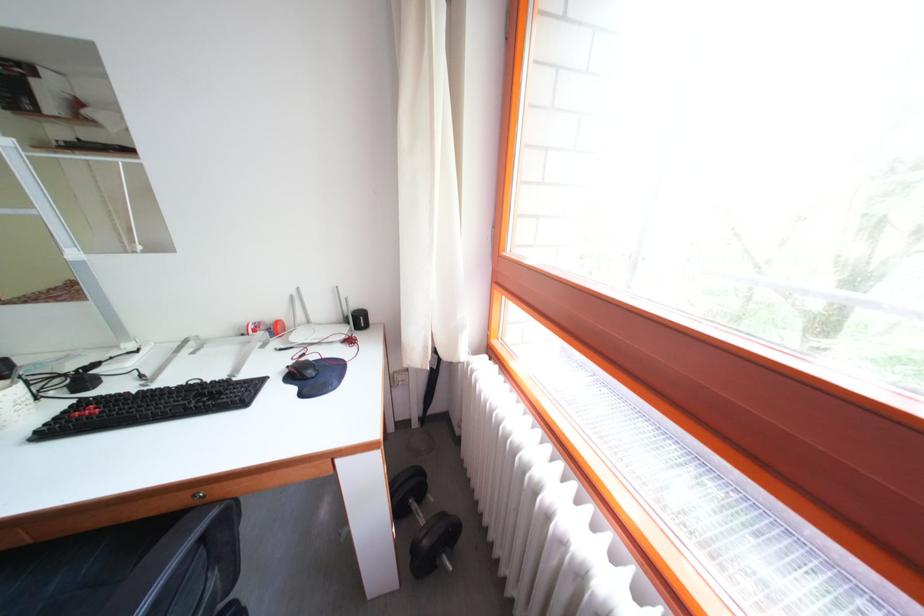
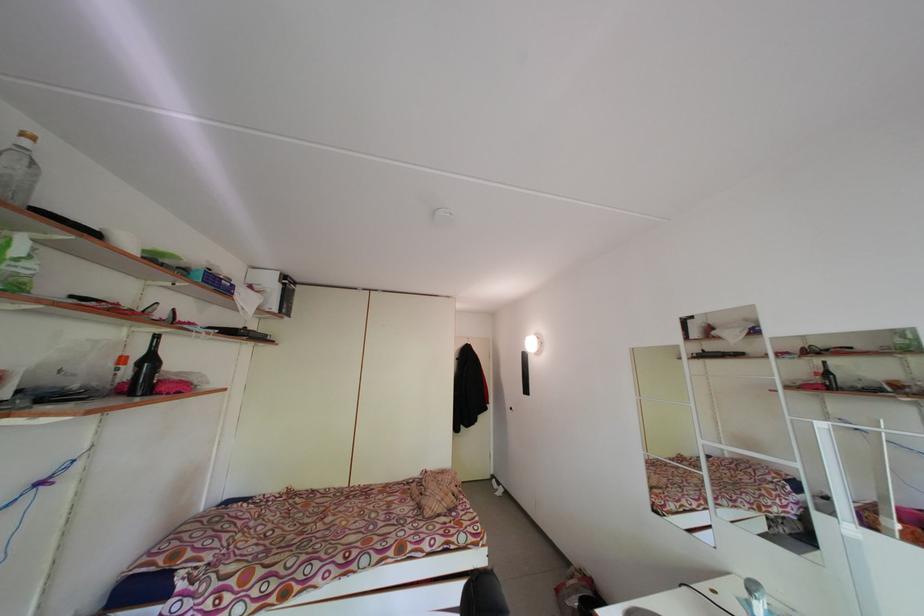
Question: The camera is either moving clockwise (left) or counter-clockwise (right) around the object. The first image is from the beginning of the video and the second image is from the end. Is the camera moving left or right when shooting the video?

Choices:
 (A) Left
 (B) Right

Answer: (B)